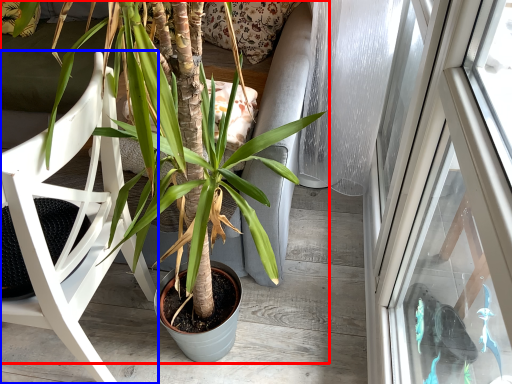
Question: Which of the following is the farthest to the observer, houseplant (highlighted by a red box) or chair (highlighted by a blue box)?

Choices:
 (A) houseplant
 (B) chair

Answer: (B)